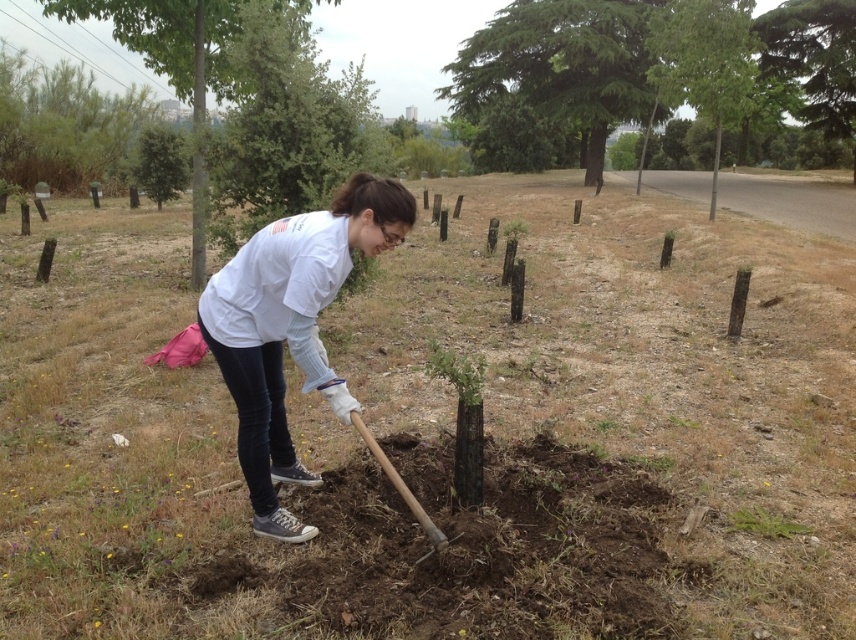
From the picture: Based on the scene description, which tree is wider, the green textured tree at upper center or the green leafy tree at upper left?

The green textured tree at upper center might be wider than the green leafy tree at upper left according to the description.

You are a gardener assessing the planting area. Which object has a greater width between the green textured tree at upper center and the wooden shovel at center?

The green textured tree at upper center has a greater width than the wooden shovel at center.